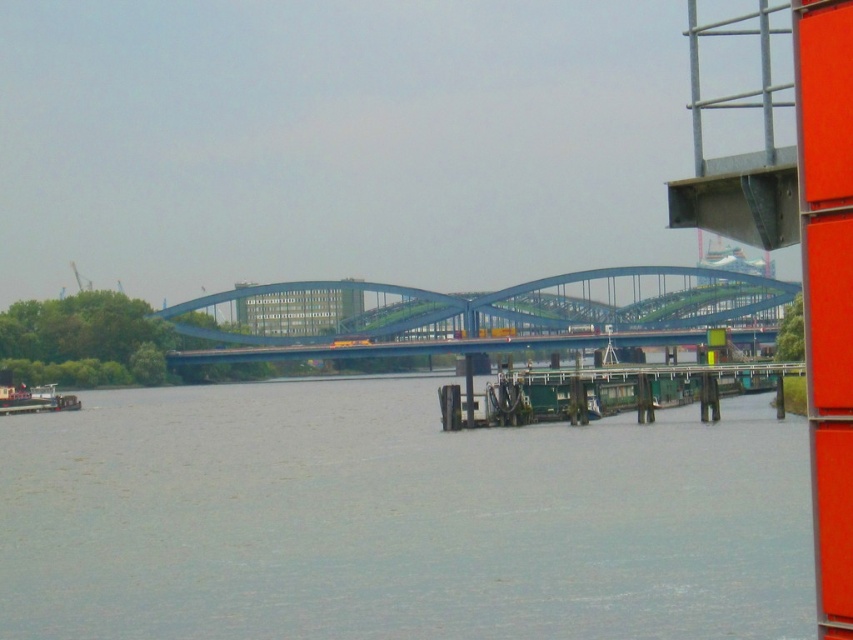
Question: Can you confirm if blue metallic bridge at center is smaller than green wooden dock at lower right?

Choices:
 (A) no
 (B) yes

Answer: (A)

Question: Does gray water at center have a greater width compared to green wooden dock at lower right?

Choices:
 (A) yes
 (B) no

Answer: (A)

Question: Which point appears closest to the camera in this image?

Choices:
 (A) (35, 390)
 (B) (396, 541)

Answer: (B)

Question: Is gray water at center closer to camera compared to blue metallic bridge at center?

Choices:
 (A) yes
 (B) no

Answer: (A)

Question: Which object is positioned closest to the blue metallic bridge at center?

Choices:
 (A) white plastic boat at lower left
 (B) green wooden dock at lower right

Answer: (A)

Question: Which object is the farthest from the white plastic boat at lower left?

Choices:
 (A) blue metallic bridge at center
 (B) green wooden dock at lower right

Answer: (B)